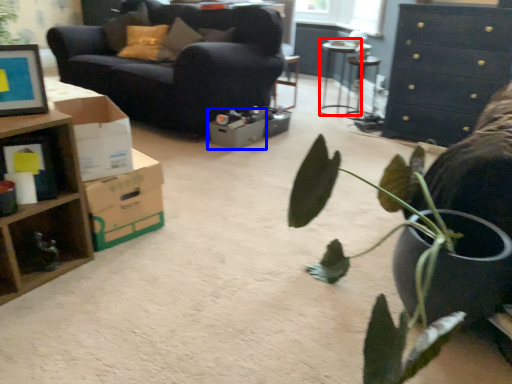
Question: Which of the following is the closest to the observer, table (highlighted by a red box) or cardboard box (highlighted by a blue box)?

Choices:
 (A) table
 (B) cardboard box

Answer: (B)